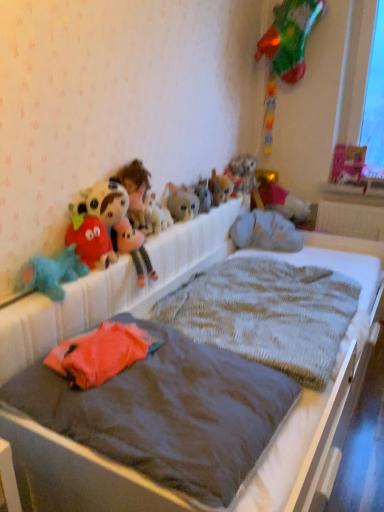
Measure the distance between point [156,389] and camera.

Point [156,389] is 4.04 feet from camera.

What is the approximate height of fluffy plush toy at center, the 8th toy viewed from the right?

7.68 inches.

The width and height of the screenshot is (384, 512). What do you see at coordinates (155, 216) in the screenshot? I see `fluffy plush toy at center, the 8th toy viewed from the right` at bounding box center [155, 216].

Measure the distance between fluffy plush toy at upper center, which ranks as the 3th toy in left-to-right order, and camera.

The depth of fluffy plush toy at upper center, which ranks as the 3th toy in left-to-right order, is 1.71 meters.

Consider the image. How much space does fluffy blue stuffed animal at left, which appears as the eleventh toy when viewed from the right, occupy vertically?

The height of fluffy blue stuffed animal at left, which appears as the eleventh toy when viewed from the right, is 6.17 inches.

This screenshot has height=512, width=384. Identify the location of red plush strawberry at upper left, which ranks as the 10th toy in right-to-left order. (90, 240).

In the scene shown: What is the approximate height of fluffy gray stuffed animal at upper center, arranged as the 8th toy when viewed from the left?

The height of fluffy gray stuffed animal at upper center, arranged as the 8th toy when viewed from the left, is 26.18 centimeters.

Describe the element at coordinates (265, 232) in the screenshot. I see `soft plush elephant at center, acting as the third toy starting from the right` at that location.

Based on the photo, in order to face pink cardboard box at upper right, which is the eleventh toy in left-to-right order, should I rotate leftwards or rightwards?

Turn right approximately 20.754 degrees to face it.

I want to click on dark gray fabric mattress at center, which is the second mattress in back-to-front order, so point(170,414).

This screenshot has width=384, height=512. I want to click on the 7th toy in front of the pink cardboard box at upper right, acting as the 1th toy starting from the right, starting your count from the anchor, so click(155, 216).

From the image's perspective, which is above, fluffy plush toy at center, the 8th toy viewed from the right, or pink cardboard box at upper right, which is the eleventh toy in left-to-right order?

pink cardboard box at upper right, which is the eleventh toy in left-to-right order, is shown above in the image.

Is fluffy plush toy at center, the 8th toy viewed from the right, positioned with its back to pink cardboard box at upper right, acting as the 1th toy starting from the right?

fluffy plush toy at center, the 8th toy viewed from the right, is not turned away from pink cardboard box at upper right, acting as the 1th toy starting from the right.

Is fluffy plush toy at center, the 8th toy viewed from the right, wider or thinner than pink cardboard box at upper right, which is the eleventh toy in left-to-right order?

Considering their sizes, fluffy plush toy at center, the 8th toy viewed from the right, looks slimmer than pink cardboard box at upper right, which is the eleventh toy in left-to-right order.

Is textured gray blanket at center taller or shorter than red plush strawberry at upper left, which ranks as the 10th toy in right-to-left order?

Clearly, textured gray blanket at center is taller compared to red plush strawberry at upper left, which ranks as the 10th toy in right-to-left order.

From a real-world perspective, who is located higher, textured gray blanket at center or red plush strawberry at upper left, which ranks as the 10th toy in right-to-left order?

red plush strawberry at upper left, which ranks as the 10th toy in right-to-left order, from a real-world perspective.

Measure the distance between textured gray blanket at center and red plush strawberry at upper left, which is counted as the 2th toy, starting from the left.

42.51 centimeters.

Where is `bed located underneath the red plush strawberry at upper left, which ranks as the 10th toy in right-to-left order (from a real-world perspective)`? This screenshot has height=512, width=384. bed located underneath the red plush strawberry at upper left, which ranks as the 10th toy in right-to-left order (from a real-world perspective) is located at coordinates (112, 289).

From the image's perspective, is fluffy blue stuffed animal at left, which appears as the eleventh toy when viewed from the right, beneath fluffy gray stuffed animal at center, which appears as the 5th toy when viewed from the right?

Indeed, from the image's perspective, fluffy blue stuffed animal at left, which appears as the eleventh toy when viewed from the right, is shown beneath fluffy gray stuffed animal at center, which appears as the 5th toy when viewed from the right.

Considering the positions of objects fluffy blue stuffed animal at left, which appears as the eleventh toy when viewed from the right, and fluffy gray stuffed animal at center, which appears as the 5th toy when viewed from the right, in the image provided, who is more to the right, fluffy blue stuffed animal at left, which appears as the eleventh toy when viewed from the right, or fluffy gray stuffed animal at center, which appears as the 5th toy when viewed from the right,?

fluffy gray stuffed animal at center, which appears as the 5th toy when viewed from the right.

Does fluffy blue stuffed animal at left, which appears as the eleventh toy when viewed from the right, come behind fluffy gray stuffed animal at center, which appears as the 5th toy when viewed from the right?

No.

Is soft plush elephant at center, acting as the 9th toy starting from the left, oriented towards textured gray blanket at center?

Yes, soft plush elephant at center, acting as the 9th toy starting from the left, faces towards textured gray blanket at center.

Is soft plush elephant at center, acting as the 9th toy starting from the left, next to textured gray blanket at center and touching it?

soft plush elephant at center, acting as the 9th toy starting from the left, is not next to textured gray blanket at center, and they're not touching.

Considering the sizes of objects soft plush elephant at center, acting as the 9th toy starting from the left, and textured gray blanket at center in the image provided, who is thinner, soft plush elephant at center, acting as the 9th toy starting from the left, or textured gray blanket at center?

soft plush elephant at center, acting as the 9th toy starting from the left, is thinner.

At what (x,y) coordinates should I click in order to perform the action: click on toy that is the 3rd object located above the textured gray blanket at center (from the image's perspective). Please return your answer as a coordinate pair (x, y). Looking at the image, I should click on (265, 232).

Is the position of dark gray fabric mattress at center, which is the second mattress in back-to-front order, more distant than that of gray fabric teddy bear at upper center, which appears as the second toy when viewed from the right?

No, it is not.

How far apart are dark gray fabric mattress at center, which is the second mattress in back-to-front order, and gray fabric teddy bear at upper center, which appears as the second toy when viewed from the right?

A distance of 6.13 feet exists between dark gray fabric mattress at center, which is the second mattress in back-to-front order, and gray fabric teddy bear at upper center, which appears as the second toy when viewed from the right.

Considering the relative positions of dark gray fabric mattress at center, positioned as the 1th mattress in front-to-back order, and gray fabric teddy bear at upper center, which is the 10th toy from left to right, in the image provided, is dark gray fabric mattress at center, positioned as the 1th mattress in front-to-back order, to the left of gray fabric teddy bear at upper center, which is the 10th toy from left to right, from the viewer's perspective?

Correct, you'll find dark gray fabric mattress at center, positioned as the 1th mattress in front-to-back order, to the left of gray fabric teddy bear at upper center, which is the 10th toy from left to right.

How many degrees apart are the facing directions of fluffy plush toy at upper center, the 9th toy when ordered from right to left, and soft plush elephant at center, acting as the third toy starting from the right?

The facing directions of fluffy plush toy at upper center, the 9th toy when ordered from right to left, and soft plush elephant at center, acting as the third toy starting from the right, are 0.000769 degrees apart.

Based on their sizes in the image, would you say fluffy plush toy at upper center, which ranks as the 3th toy in left-to-right order, is bigger or smaller than soft plush elephant at center, acting as the third toy starting from the right?

Considering their sizes, fluffy plush toy at upper center, which ranks as the 3th toy in left-to-right order, takes up less space than soft plush elephant at center, acting as the third toy starting from the right.

How much distance is there between fluffy plush toy at upper center, which ranks as the 3th toy in left-to-right order, and soft plush elephant at center, acting as the third toy starting from the right?

A distance of 92.92 centimeters exists between fluffy plush toy at upper center, which ranks as the 3th toy in left-to-right order, and soft plush elephant at center, acting as the third toy starting from the right.

From the picture: From a real-world perspective, is fluffy plush toy at upper center, the 9th toy when ordered from right to left, on soft plush elephant at center, acting as the third toy starting from the right?

Correct, in the physical world, fluffy plush toy at upper center, the 9th toy when ordered from right to left, is higher than soft plush elephant at center, acting as the third toy starting from the right.

From the picture: Can you tell me how much fluffy gray stuffed animal at center, which appears as the 5th toy when viewed from the right, and fluffy plush toy at upper center, which ranks as the 3th toy in left-to-right order, differ in facing direction?

The facing directions of fluffy gray stuffed animal at center, which appears as the 5th toy when viewed from the right, and fluffy plush toy at upper center, which ranks as the 3th toy in left-to-right order, are 0.00121 degrees apart.

From the picture: Considering the relative positions of fluffy gray stuffed animal at center, which appears as the 5th toy when viewed from the right, and fluffy plush toy at upper center, which ranks as the 3th toy in left-to-right order, in the image provided, is fluffy gray stuffed animal at center, which appears as the 5th toy when viewed from the right, behind fluffy plush toy at upper center, which ranks as the 3th toy in left-to-right order,?

Yes, it is behind fluffy plush toy at upper center, which ranks as the 3th toy in left-to-right order.

Where is `toy that is the 5th one when counting forward from the fluffy gray stuffed animal at center, which appears as the 5th toy when viewed from the right`? The image size is (384, 512). toy that is the 5th one when counting forward from the fluffy gray stuffed animal at center, which appears as the 5th toy when viewed from the right is located at coordinates (135, 189).

Is fluffy gray stuffed animal at center, which ranks as the 7th toy in left-to-right order, in contact with fluffy plush toy at upper center, which ranks as the 3th toy in left-to-right order?

fluffy gray stuffed animal at center, which ranks as the 7th toy in left-to-right order, and fluffy plush toy at upper center, which ranks as the 3th toy in left-to-right order, are clearly separated.

Find the location of a particular element. The image size is (384, 512). the 6th toy directly beneath the pink cardboard box at upper right, which is the eleventh toy in left-to-right order (from a real-world perspective) is located at coordinates (155, 216).

This screenshot has width=384, height=512. I want to click on bed below the red plush strawberry at upper left, which ranks as the 10th toy in right-to-left order (from the image's perspective), so click(112, 289).

Estimate the real-world distances between objects in this image. Which object is further from fuzzy plush toys at center, which appears as the sixth toy when viewed from the left, fluffy gray stuffed animal at center, which ranks as the 7th toy in left-to-right order, or fluffy gray cat at center, the seventh toy in the right-to-left sequence?

fluffy gray cat at center, the seventh toy in the right-to-left sequence, is further to fuzzy plush toys at center, which appears as the sixth toy when viewed from the left.

When comparing their distances from knitted gray blanket at center, which is the second mattress from front to back, does pink cardboard box at upper right, which is the eleventh toy in left-to-right order, or dark gray fabric mattress at center, positioned as the 1th mattress in front-to-back order, seem further?

pink cardboard box at upper right, which is the eleventh toy in left-to-right order, is further to knitted gray blanket at center, which is the second mattress from front to back.

Considering their positions, is textured gray blanket at center positioned closer to pink cardboard box at upper right, acting as the 1th toy starting from the right, than knitted gray blanket at center, which is the second mattress from front to back?

knitted gray blanket at center, which is the second mattress from front to back, lies closer to pink cardboard box at upper right, acting as the 1th toy starting from the right, than the other object.

Based on their spatial positions, is fluffy blue stuffed animal at left, which appears as the eleventh toy when viewed from the right, or textured gray blanket at center further from fluffy gray cat at center, arranged as the 5th toy when viewed from the left?

Among the two, fluffy blue stuffed animal at left, which appears as the eleventh toy when viewed from the right, is located further to fluffy gray cat at center, arranged as the 5th toy when viewed from the left.

Considering their positions, is fluffy gray stuffed animal at upper center, arranged as the 8th toy when viewed from the left, positioned further to pink cardboard box at upper right, acting as the 1th toy starting from the right, than fluffy plush toy at upper center, the 9th toy when ordered from right to left?

fluffy plush toy at upper center, the 9th toy when ordered from right to left, is positioned further to the anchor pink cardboard box at upper right, acting as the 1th toy starting from the right.

From the image, which object appears to be nearer to fuzzy plush toys at center, placed as the sixth toy when sorted from right to left, red plush strawberry at upper left, which ranks as the 10th toy in right-to-left order, or fluffy plush toy at upper center, which ranks as the 3th toy in left-to-right order?

fluffy plush toy at upper center, which ranks as the 3th toy in left-to-right order, lies closer to fuzzy plush toys at center, placed as the sixth toy when sorted from right to left, than the other object.

Considering their positions, is fluffy gray stuffed animal at upper center, arranged as the 8th toy when viewed from the left, positioned further to soft plush elephant at center, acting as the third toy starting from the right, than textured gray blanket at center?

textured gray blanket at center.

Which object lies nearer to the anchor point fluffy plush toy at upper center, which ranks as the 3th toy in left-to-right order, fluffy blue stuffed animal at left, which appears as the eleventh toy when viewed from the right, or pink cardboard box at upper right, acting as the 1th toy starting from the right?

fluffy blue stuffed animal at left, which appears as the eleventh toy when viewed from the right, is closer to fluffy plush toy at upper center, which ranks as the 3th toy in left-to-right order.

You are a GUI agent. You are given a task and a screenshot of the screen. Output one action in this format:
    pyautogui.click(x=<x>, y=<y>)
    Task: Click on the toy situated between soft plush elephant at center, acting as the third toy starting from the right, and pink cardboard box at upper right, which is the eleventh toy in left-to-right order, from left to right
    The height and width of the screenshot is (512, 384).
    Given the screenshot: What is the action you would take?
    pyautogui.click(x=282, y=201)

You are a GUI agent. You are given a task and a screenshot of the screen. Output one action in this format:
    pyautogui.click(x=<x>, y=<y>)
    Task: Click on the mattress between dark gray fabric mattress at center, which is the second mattress in back-to-front order, and gray fabric teddy bear at upper center, which is the 10th toy from left to right, in the front-back direction
    The image size is (384, 512).
    Given the screenshot: What is the action you would take?
    pyautogui.click(x=267, y=313)

What are the coordinates of `mattress between dark gray fabric mattress at center, positioned as the 1th mattress in front-to-back order, and fluffy plush toy at center, acting as the 4th toy starting from the left, from front to back` in the screenshot? It's located at (267, 313).

Locate an element on the screen. mattress positioned between dark gray fabric mattress at center, positioned as the 1th mattress in front-to-back order, and pink cardboard box at upper right, acting as the 1th toy starting from the right, from near to far is located at coordinates (267, 313).